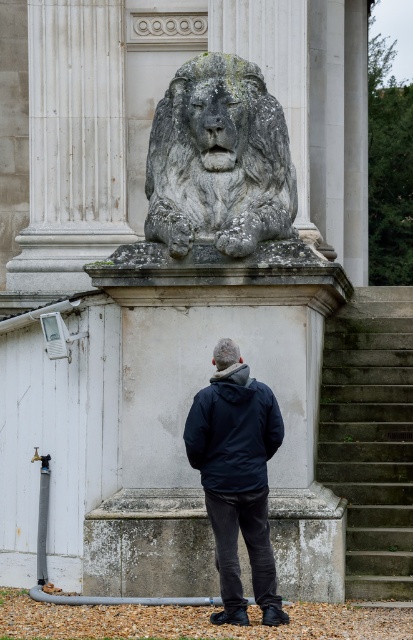
How far apart are gray concrete stairs at lower right and dark blue jacket at center?

They are 16.87 feet apart.

Between point (401, 330) and point (220, 579), which one is positioned behind?

The point (401, 330) is behind.

At what (x,y) coordinates should I click in order to perform the action: click on gray concrete stairs at lower right. Please return your answer as a coordinate pair (x, y). Looking at the image, I should click on (370, 436).

Looking at this image, can you confirm if dark blue jacket at center is positioned to the right of navy blue jacket at center?

Yes, dark blue jacket at center is to the right of navy blue jacket at center.

Is dark blue jacket at center bigger than navy blue jacket at center?

Correct, dark blue jacket at center is larger in size than navy blue jacket at center.

Is point (234, 451) less distant than point (209, 424)?

Yes, it is in front of point (209, 424).

Identify the location of dark blue jacket at center. click(x=237, y=477).

Locate an element on the screen. The height and width of the screenshot is (640, 413). gray concrete stairs at lower right is located at coordinates (370, 436).

Measure the distance from gray concrete stairs at lower right to gray stone lion at center.

gray concrete stairs at lower right is 5.53 meters away from gray stone lion at center.

Which is in front, point (356, 595) or point (208, 115)?

Point (208, 115)

Where is `gray concrete stairs at lower right`? gray concrete stairs at lower right is located at coordinates (x=370, y=436).